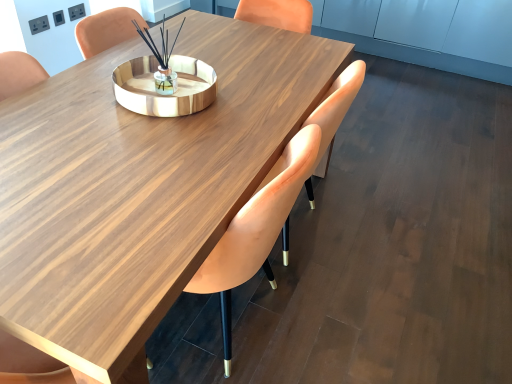
I want to click on spots to the right of wooden table at center, so click(x=397, y=256).